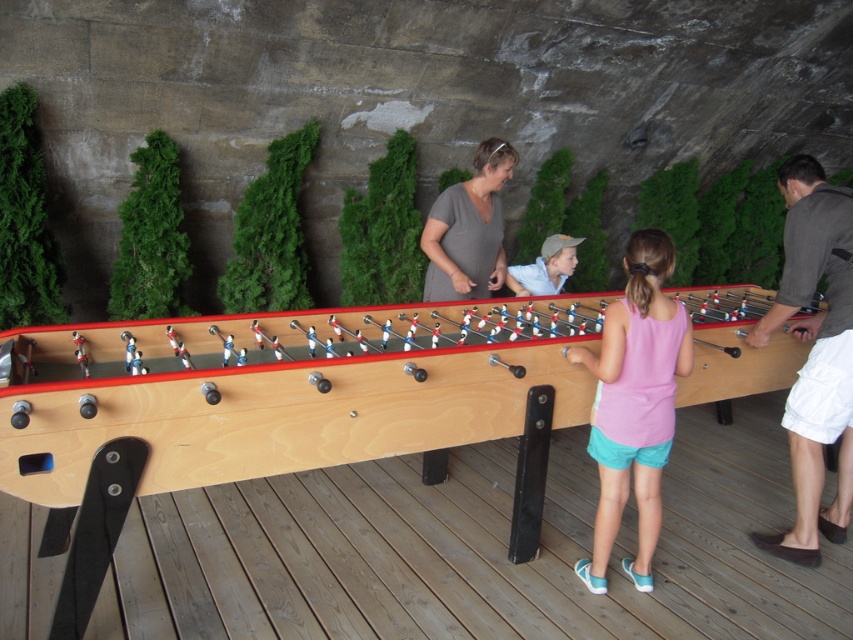
Is matte gray shirt at center in front of light blue denim shorts at center?

Yes, it is in front of light blue denim shorts at center.

Can you confirm if matte gray shirt at center is wider than light blue denim shorts at center?

Correct, the width of matte gray shirt at center exceeds that of light blue denim shorts at center.

Locate an element on the screen. The height and width of the screenshot is (640, 853). matte gray shirt at center is located at coordinates (468, 228).

Is point (840, 241) closer to camera compared to point (604, 368)?

No, (840, 241) is behind (604, 368).

Can you confirm if dark gray fabric shirt at right is positioned below pink fabric shirt at center?

No, dark gray fabric shirt at right is not below pink fabric shirt at center.

Is point (784, 557) closer to camera compared to point (659, 291)?

No, (784, 557) is further to viewer.

At what (x,y) coordinates should I click in order to perform the action: click on dark gray fabric shirt at right. Please return your answer as a coordinate pair (x, y). Looking at the image, I should click on (814, 353).

Is pink fabric shirt at center to the right of matte gray shirt at center from the viewer's perspective?

Yes, pink fabric shirt at center is to the right of matte gray shirt at center.

Is point (639, 372) farther from camera compared to point (451, 192)?

No.

Find the location of a particular element. This screenshot has height=640, width=853. pink fabric shirt at center is located at coordinates (634, 403).